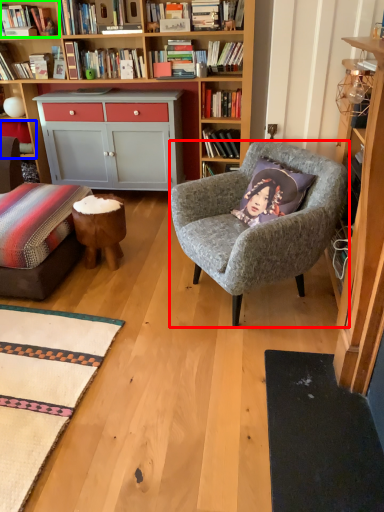
Question: Which object is the farthest from chair (highlighted by a red box)? Choose among these: shelf (highlighted by a blue box) or shelf (highlighted by a green box).

Choices:
 (A) shelf
 (B) shelf

Answer: (A)